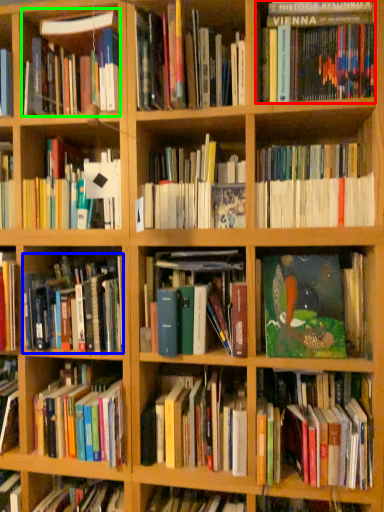
Question: Considering the real-world distances, which object is farthest from book (highlighted by a red box)? book (highlighted by a blue box) or book (highlighted by a green box)?

Choices:
 (A) book
 (B) book

Answer: (A)